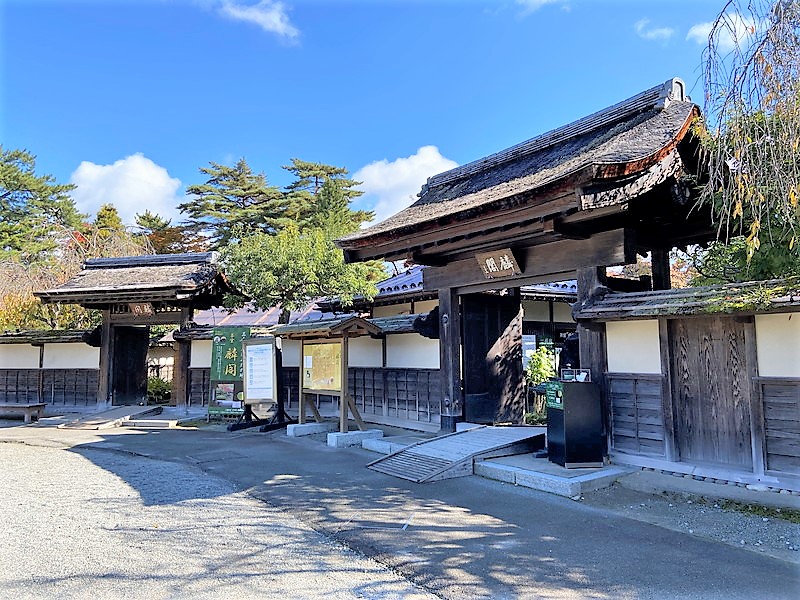
Locate an element on the screen. This screenshot has width=800, height=600. places to sit is located at coordinates (14, 410).